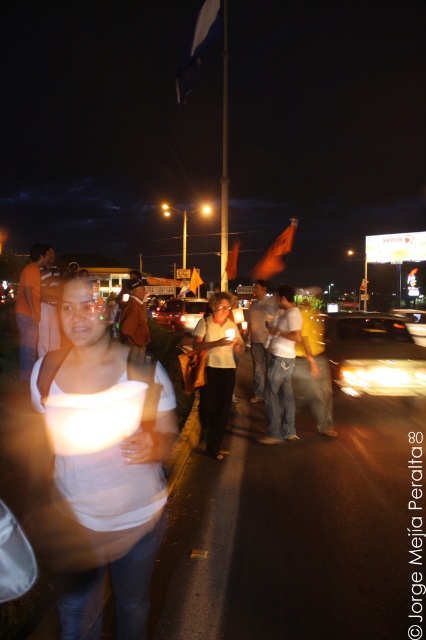
Looking at this image, you are a photographer standing in front of the scene. You notice two objects labeled as white matte shirt at center and matte white shirt at center. Which one is smaller in size?

The white matte shirt at center is smaller in size than the matte white shirt at center according to the description.

You are a photographer standing at the edge of the road. You notice two people in the crowd wearing a yellow fabric shirt at center and a brown leather jacket at center. Which one do you think is closer to you based on their clothing size?

The yellow fabric shirt at center has a larger size compared to the brown leather jacket at center, so the person wearing the yellow fabric shirt at center is closer to you.